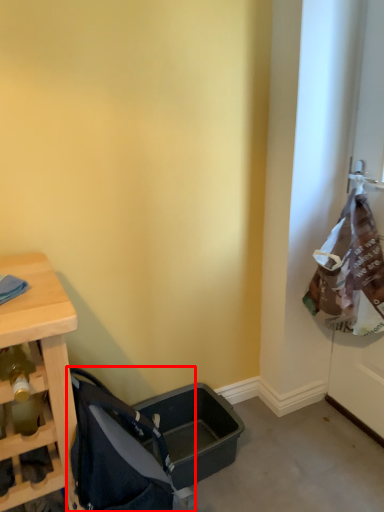
Question: Observing the image, what is the correct spatial positioning of baby carriage (annotated by the red box) in reference to screen door?

Choices:
 (A) right
 (B) left

Answer: (B)